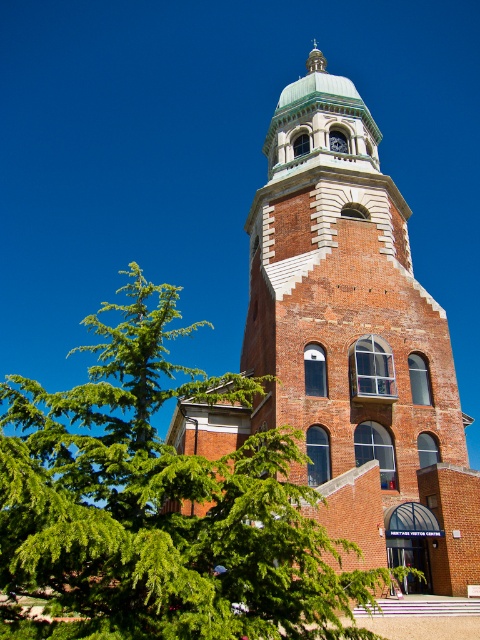
You are standing in front of the brick tower at center and want to take a photo of it. However, there is a green leafy tree at lower left blocking your view. Can you move to the right side of the tree to get an unobstructed view of the tower?

The green leafy tree at lower left is closer to the viewer than the brick tower at center. Moving to the right side of the tree may allow you to see around it and get an unobstructed view of the tower since the tree is in front of the tower.

You are standing at the base of the brick tower at center and want to get a clear view of its clock face. The green leafy tree at lower left is blocking your view. How can you adjust your position to see the clock face better?

The green leafy tree at lower left is positioned under the brick tower at center, so moving to the right side of the green leafy tree at lower left would provide an unobstructed view of the clock face on the brick tower at center.

You are standing in front of the historic brick tower and want to determine which of the two points, point (154, 412) or point (407, 397), is closer to you. Based on the image, which point is nearer?

Point (154, 412) is closer to you because it is further to the viewer than point (407, 397).